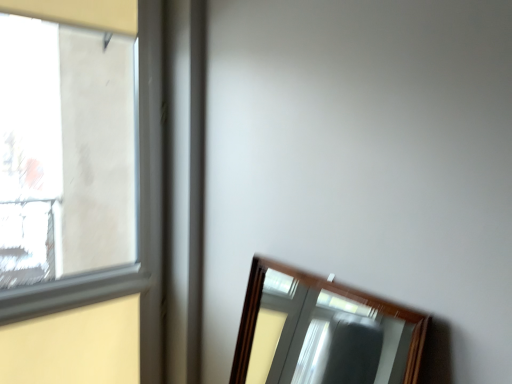
The image size is (512, 384). In order to click on clear glass window at left in this screenshot , I will do `click(139, 180)`.

The image size is (512, 384). Describe the element at coordinates (139, 180) in the screenshot. I see `clear glass window at left` at that location.

What is the approximate height of clear glass window at left?

The height of clear glass window at left is 1.50 meters.

At what (x,y) coordinates should I click in order to perform the action: click on clear glass window at left. Please return your answer as a coordinate pair (x, y). Looking at the image, I should click on (139, 180).